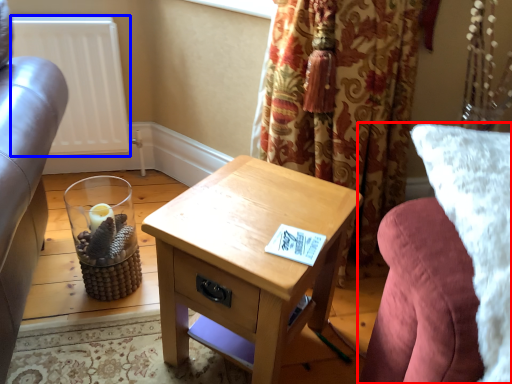
Question: Which of the following is the closest to the observer, studio couch (highlighted by a red box) or radiator (highlighted by a blue box)?

Choices:
 (A) studio couch
 (B) radiator

Answer: (A)